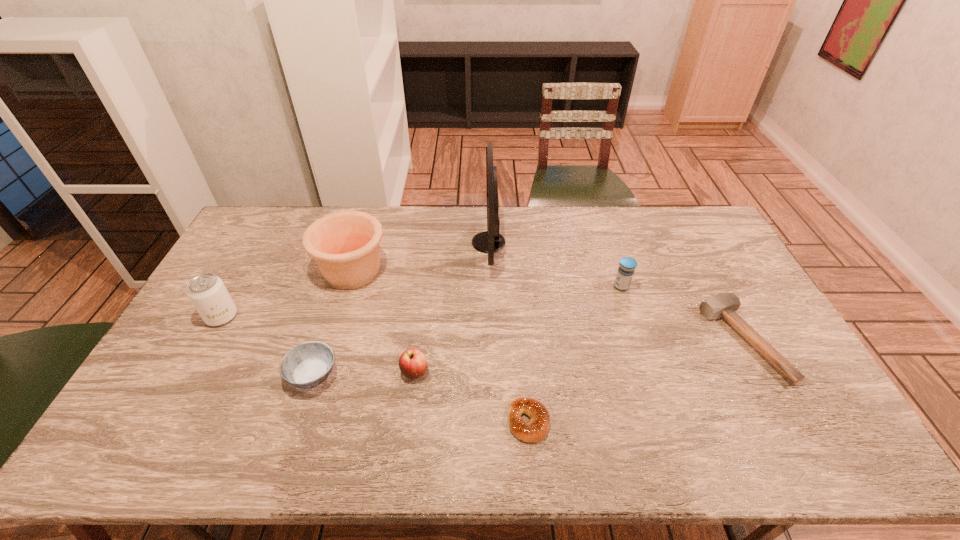
This screenshot has width=960, height=540. Find the location of `free space that satisfies the following two spatial constraints: 1. on the front side of the nearest object; 2. on the left side of the pottery`. free space that satisfies the following two spatial constraints: 1. on the front side of the nearest object; 2. on the left side of the pottery is located at coordinates (306, 421).

The image size is (960, 540). In order to click on vacant space that satisfies the following two spatial constraints: 1. on the front-facing side of the computer monitor; 2. on the front side of the pottery in this screenshot , I will do `click(489, 271)`.

Locate an element on the screen. The image size is (960, 540). free space that satisfies the following two spatial constraints: 1. on the back side of the sixth tallest object; 2. on the left side of the fifth object from right to left is located at coordinates (315, 372).

The width and height of the screenshot is (960, 540). I want to click on vacant space that satisfies the following two spatial constraints: 1. on the front side of the bagel; 2. on the left side of the apple, so click(409, 421).